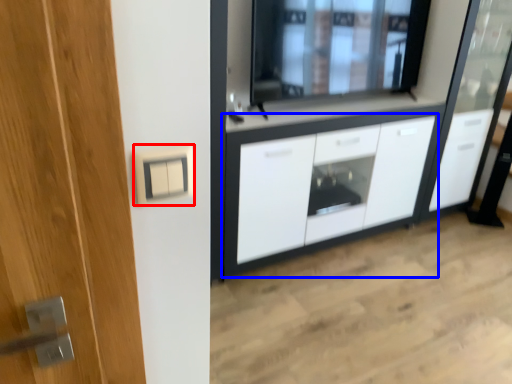
Question: Among these objects, which one is farthest to the camera, electric outlet (highlighted by a red box) or cabinetry (highlighted by a blue box)?

Choices:
 (A) electric outlet
 (B) cabinetry

Answer: (B)